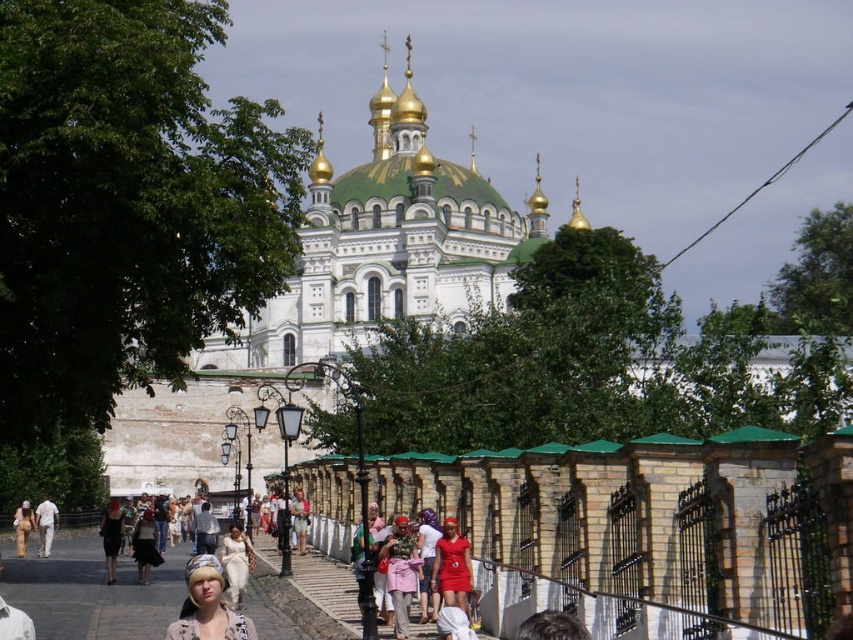
Can you confirm if cobblestone pathway at center is positioned above camouflage-patterned shirt at center?

Incorrect, cobblestone pathway at center is not positioned above camouflage-patterned shirt at center.

Is cobblestone pathway at center shorter than camouflage-patterned shirt at center?

Incorrect, cobblestone pathway at center's height does not fall short of camouflage-patterned shirt at center's.

Does point (10, 572) come in front of point (412, 538)?

That is False.

Where is `cobblestone pathway at center`? This screenshot has height=640, width=853. cobblestone pathway at center is located at coordinates (90, 589).

In the scene shown: Who is more forward, (x=289, y=348) or (x=227, y=576)?

Point (x=227, y=576) is more forward.

Which of these two, white stone church at center or white cotton dress at center, stands taller?

With more height is white stone church at center.

Which is in front, point (306, 236) or point (225, 589)?

Point (225, 589) is more forward.

I want to click on white stone church at center, so tap(334, 296).

Can you confirm if white stone church at center is taller than denim jacket at lower left?

Yes, white stone church at center is taller than denim jacket at lower left.

Can you confirm if white stone church at center is positioned to the left of denim jacket at lower left?

Incorrect, white stone church at center is not on the left side of denim jacket at lower left.

Which is behind, point (489, 224) or point (22, 547)?

The point (489, 224) is more distant.

Find the location of a particular element. Image resolution: width=853 pixels, height=640 pixels. white stone church at center is located at coordinates (334, 296).